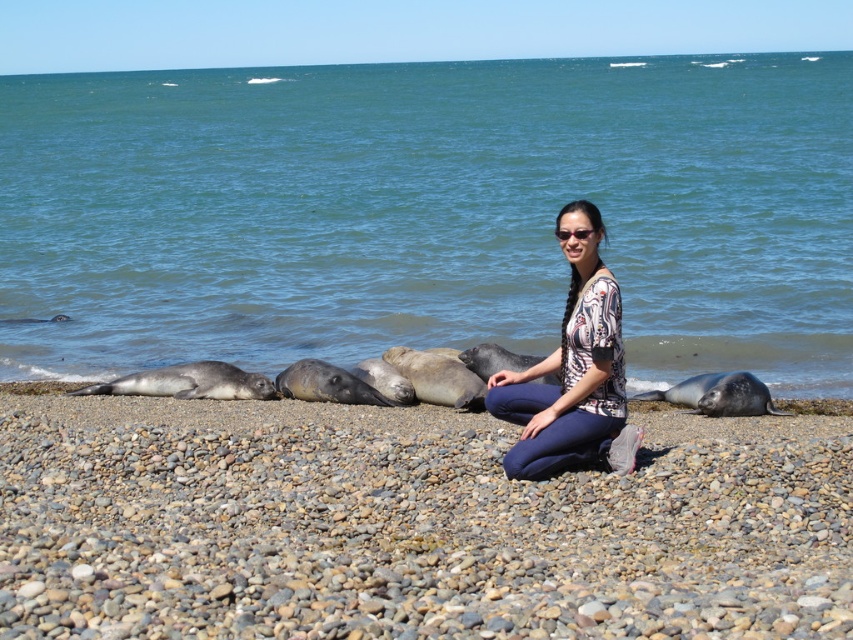
Is gray pebbled beach at center shorter than printed fabric blouse at center?

Indeed, gray pebbled beach at center has a lesser height compared to printed fabric blouse at center.

Which of these two, gray pebbled beach at center or printed fabric blouse at center, stands taller?

With more height is printed fabric blouse at center.

Does point (216, 554) come farther from viewer compared to point (611, 452)?

No, (216, 554) is in front of (611, 452).

Locate an element on the screen. The width and height of the screenshot is (853, 640). gray pebbled beach at center is located at coordinates (409, 525).

Is blue water at center wider than gray pebbled beach at center?

Correct, the width of blue water at center exceeds that of gray pebbled beach at center.

Between blue water at center and gray pebbled beach at center, which one has more height?

blue water at center is taller.

Which is in front, point (613, 161) or point (91, 618)?

Point (91, 618)

Image resolution: width=853 pixels, height=640 pixels. Find the location of `blue water at center`. blue water at center is located at coordinates (428, 212).

Does blue water at center lie in front of printed fabric blouse at center?

No, blue water at center is further to the viewer.

Does point (144, 86) come closer to viewer compared to point (561, 317)?

No, it is behind (561, 317).

At what (x,y) coordinates should I click in order to perform the action: click on blue water at center. Please return your answer as a coordinate pair (x, y). Looking at the image, I should click on (428, 212).

Locate an element on the screen. blue water at center is located at coordinates (428, 212).